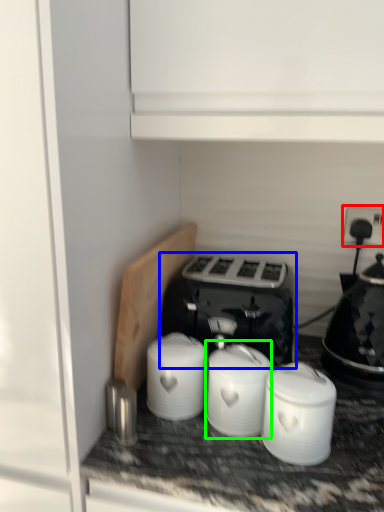
Question: Which is nearer to the electric outlet (highlighted by a red box)? toaster (highlighted by a blue box) or appliance (highlighted by a green box).

Choices:
 (A) toaster
 (B) appliance

Answer: (A)